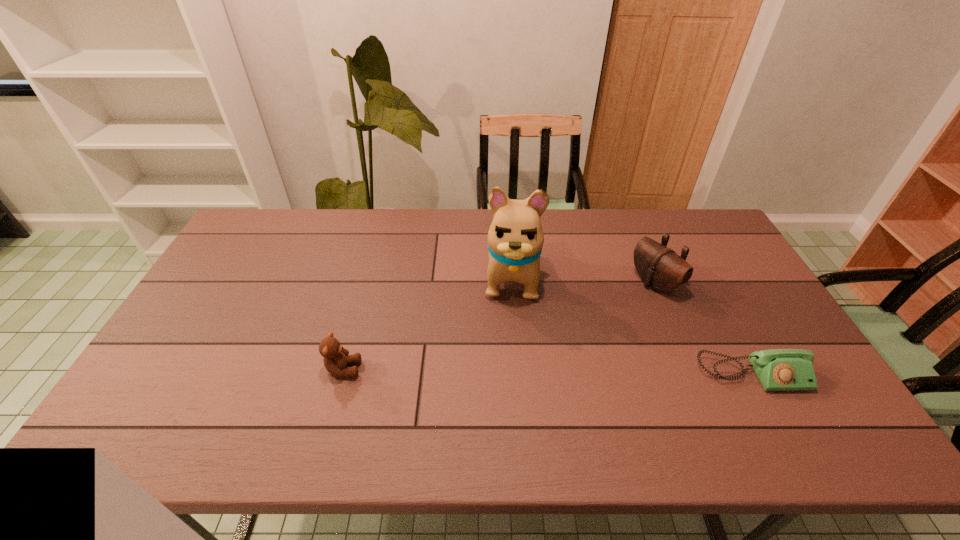
You are a GUI agent. You are given a task and a screenshot of the screen. Output one action in this format:
    pyautogui.click(x=<x>, y=<y>)
    Task: Click on the free space at the left edge of the desktop
    
    Given the screenshot: What is the action you would take?
    pyautogui.click(x=247, y=285)

Find the location of a particular element. The image size is (960, 540). free space at the right edge of the desktop is located at coordinates (768, 323).

What are the coordinates of `free space at the near left corner` in the screenshot? It's located at (186, 384).

Image resolution: width=960 pixels, height=540 pixels. I want to click on vacant space that's between the puppy and the third tallest object, so click(x=427, y=322).

Locate an element on the screen. This screenshot has height=540, width=960. blank region between the third shortest object and the puppy is located at coordinates (583, 279).

The image size is (960, 540). In order to click on free space between the pouch and the tallest object in this screenshot , I will do point(583,279).

Find the location of a particular element. This screenshot has width=960, height=540. free space between the shortest object and the tallest object is located at coordinates (632, 325).

Locate an element on the screen. empty space that is in between the second object from left to right and the telephone is located at coordinates (632, 325).

Identify the location of free space that is in between the third shortest object and the shortest object. (704, 329).

Identify the location of unoccupied area between the teddy bear and the tallest object. This screenshot has height=540, width=960. (427, 322).